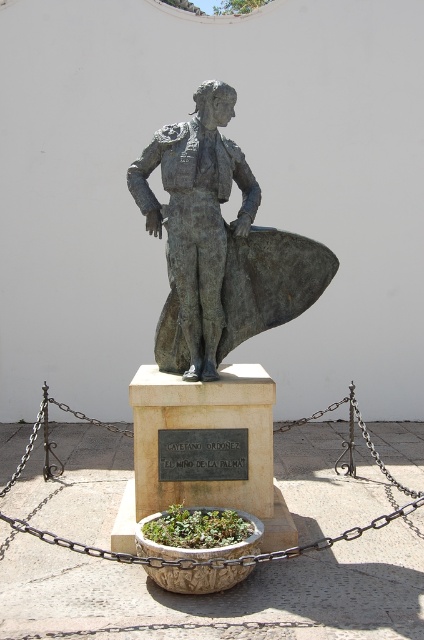
Question: Which point is farther from the camera taking this photo?

Choices:
 (A) 178,292
 (B) 387,522

Answer: (A)

Question: Is bronze statue at center above rusty metal chain at center?

Choices:
 (A) yes
 (B) no

Answer: (A)

Question: Can you confirm if bronze statue at center is positioned to the right of rusty metal chain at center?

Choices:
 (A) yes
 (B) no

Answer: (B)

Question: Which of the following is the farthest from the observer?

Choices:
 (A) rusty metal chain at center
 (B) bronze statue at center

Answer: (A)

Question: Can you confirm if bronze statue at center is smaller than rusty metal chain at center?

Choices:
 (A) no
 (B) yes

Answer: (A)

Question: Among these points, which one is farthest from the camera?

Choices:
 (A) (379, 528)
 (B) (195, 170)

Answer: (B)